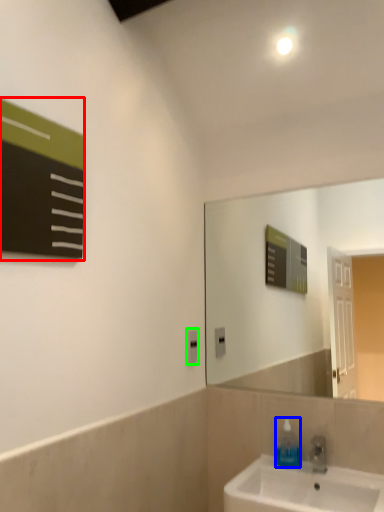
Question: Considering the real-world distances, which object is farthest from bulletin board (highlighted by a red box)? soap dispenser (highlighted by a blue box) or electric outlet (highlighted by a green box)?

Choices:
 (A) soap dispenser
 (B) electric outlet

Answer: (A)